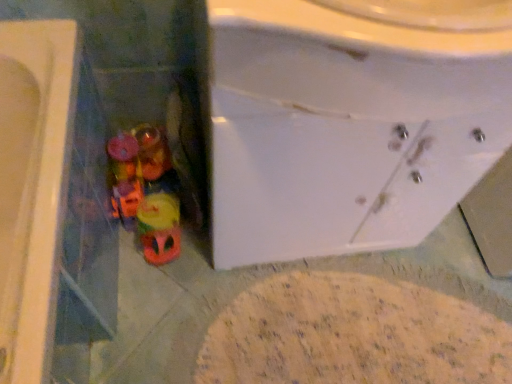
Question: From the image's perspective, is white glossy sink at center located beneath rubberized plastic toys at lower left?

Choices:
 (A) no
 (B) yes

Answer: (A)

Question: Considering the relative positions of white glossy sink at center and rubberized plastic toys at lower left in the image provided, is white glossy sink at center to the right of rubberized plastic toys at lower left from the viewer's perspective?

Choices:
 (A) yes
 (B) no

Answer: (A)

Question: Would you say white glossy sink at center is a long distance from rubberized plastic toys at lower left?

Choices:
 (A) no
 (B) yes

Answer: (A)

Question: Is white glossy sink at center positioned with its back to rubberized plastic toys at lower left?

Choices:
 (A) yes
 (B) no

Answer: (B)

Question: From a real-world perspective, does white glossy sink at center sit lower than rubberized plastic toys at lower left?

Choices:
 (A) no
 (B) yes

Answer: (A)

Question: Can you confirm if white glossy sink at center is shorter than rubberized plastic toys at lower left?

Choices:
 (A) yes
 (B) no

Answer: (B)

Question: From the image's perspective, does rubberized plastic toys at lower left appear higher than white glossy sink at center?

Choices:
 (A) yes
 (B) no

Answer: (B)

Question: Is rubberized plastic toys at lower left beside white glossy sink at center?

Choices:
 (A) yes
 (B) no

Answer: (B)

Question: Is rubberized plastic toys at lower left to the left of white glossy sink at center from the viewer's perspective?

Choices:
 (A) no
 (B) yes

Answer: (B)

Question: Could you tell me if rubberized plastic toys at lower left is turned towards white glossy sink at center?

Choices:
 (A) no
 (B) yes

Answer: (A)

Question: Can you confirm if rubberized plastic toys at lower left is taller than white glossy sink at center?

Choices:
 (A) no
 (B) yes

Answer: (A)

Question: Is rubberized plastic toys at lower left facing away from white glossy sink at center?

Choices:
 (A) yes
 (B) no

Answer: (B)

Question: Looking at the image, does white glossy sink at center seem bigger or smaller compared to rubberized plastic toys at lower left?

Choices:
 (A) small
 (B) big

Answer: (B)